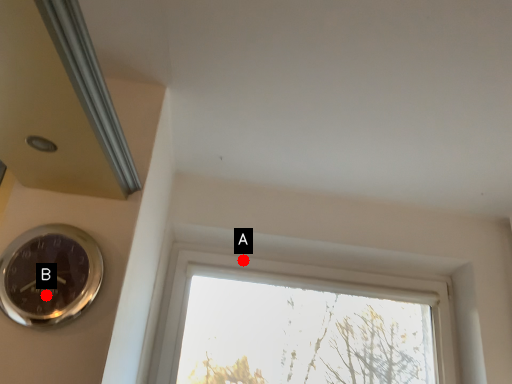
Question: Two points are circled on the image, labeled by A and B beside each circle. Which point is further to the camera?

Choices:
 (A) A is further
 (B) B is further

Answer: (A)